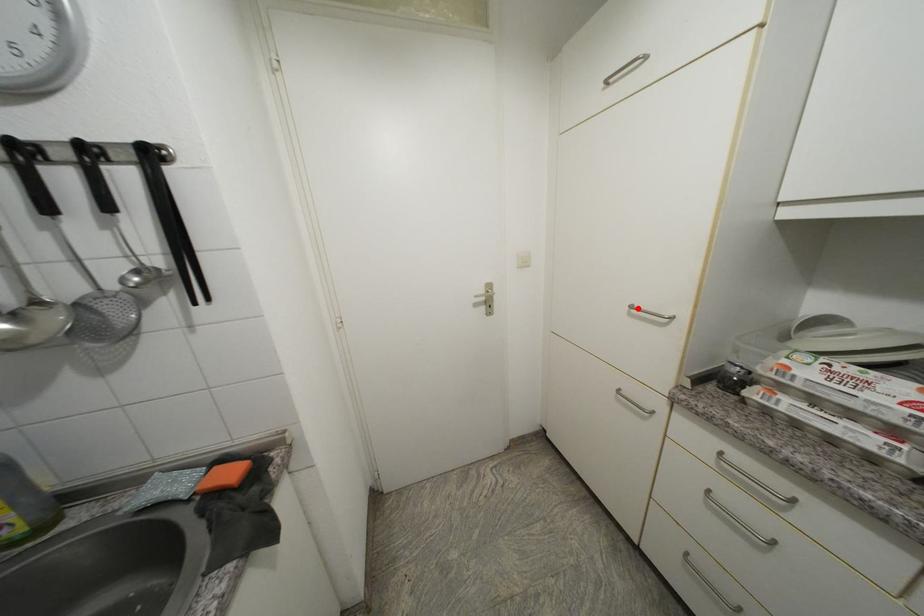
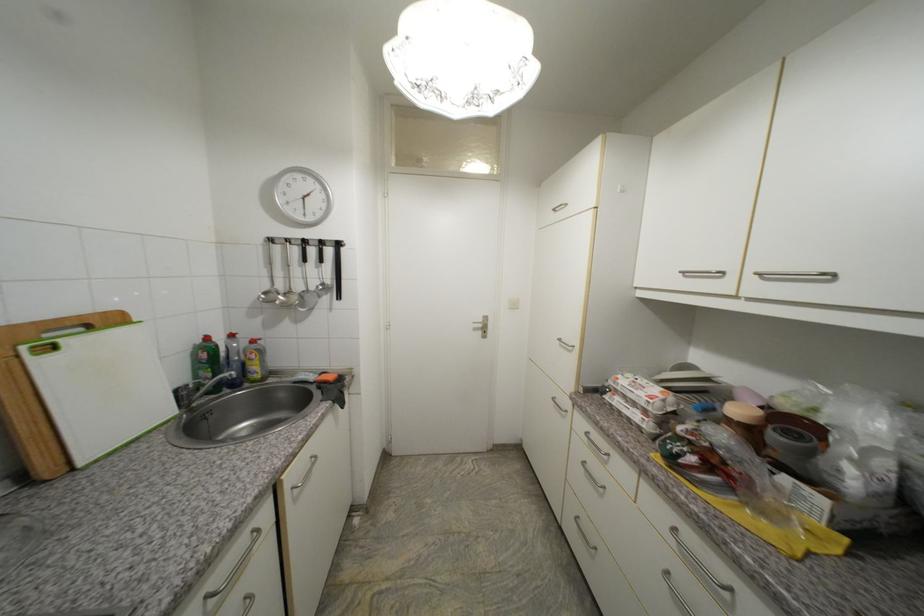
The point at the highlighted location is marked in the first image. Where is the corresponding point in the second image?

(565, 341)